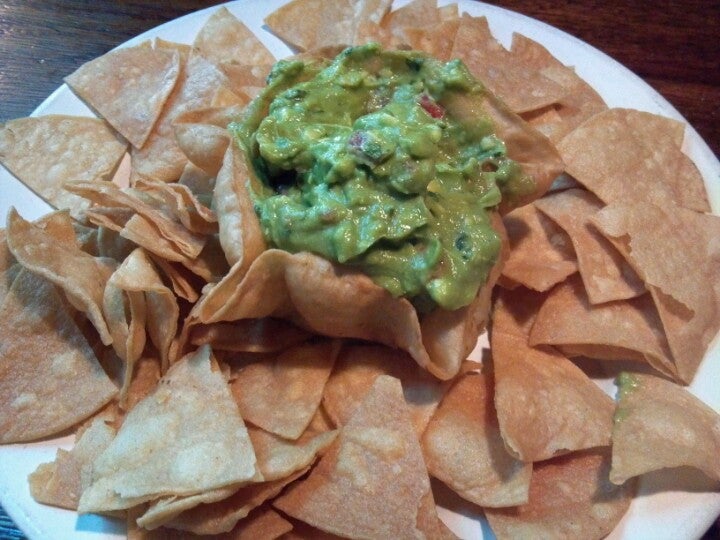
This screenshot has width=720, height=540. Identify the location of white plate. (624, 84).